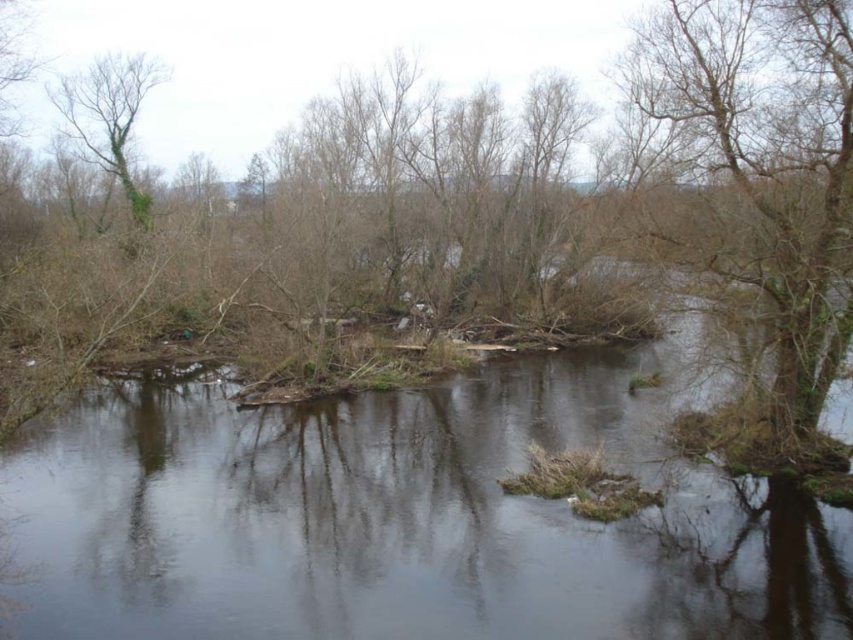
You are a kayaker planning to navigate the river shown. You notice the clear water at center and the bare branches at right. Which of these two features is closer to the surface of the water?

The clear water at center is shorter than the bare branches at right, meaning the clear water at center is closer to the surface of the water than the bare branches at right.

You are standing at point (265,632) and want to cross the river to the opposite bank. The river is 10.93 meters wide here. If your inflatable boat can carry a maximum load of 120 kg, and you weigh 70 kg, how many 5 kg rocks can you safely carry with you?

You can safely carry 10 rocks. Here is the calculation step by step. First, subtract your weight from the boat capacity to get 120 kg minus 70 kg equals 50 kg available for rocks. Then divide 50 kg by 5 kg per rock to get 10 rocks. Since you can only carry whole rocks, the answer is 10.

You are standing on the riverbank and want to cross the river using a fallen log. You see the brown wood tree at center and the clear water at center. Which object should you look to your left of to find the log?

The brown wood tree at center is to the right of clear water at center, so you should look to the left of the clear water at center to find the log.